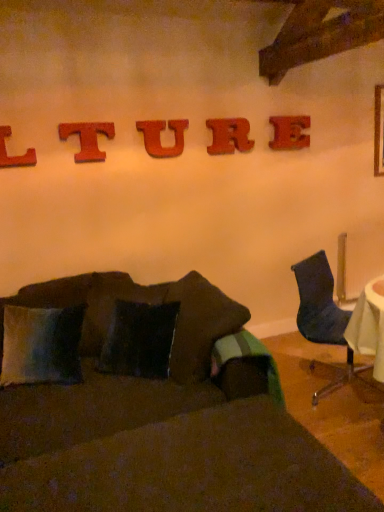
Question: Choose the correct answer: Is wooden letter r at upper center, which ranks as the second alphabet in right-to-left order, inside velvety blue pillow at lower left or outside it?

Choices:
 (A) inside
 (B) outside

Answer: (B)

Question: From the image's perspective, relative to velvety blue pillow at lower left, is wooden letter r at upper center, acting as the fourth alphabet starting from the left, above or below?

Choices:
 (A) below
 (B) above

Answer: (B)

Question: Estimate the real-world distances between objects in this image. Which object is closer to the velvet dark blue chair at right?

Choices:
 (A) velvet dark brown couch at center
 (B) wooden letter e at upper center, marked as the 1th alphabet in a right-to-left arrangement
 (C) red wood letter t at upper center, the fourth alphabet in the right-to-left sequence
 (D) velvety blue pillow at lower left
 (E) wooden letter r at upper center, which ranks as the second alphabet in right-to-left order

Answer: (B)

Question: Which of these objects is positioned farthest from the velvety blue pillow at lower left?

Choices:
 (A) red wood u at center, which ranks as the 3th alphabet in right-to-left order
 (B) velvet dark blue chair at right
 (C) velvet dark brown couch at center
 (D) wooden letter r at upper center, acting as the fourth alphabet starting from the left
 (E) red wood letter t at upper center, the 2th alphabet positioned from the left

Answer: (D)